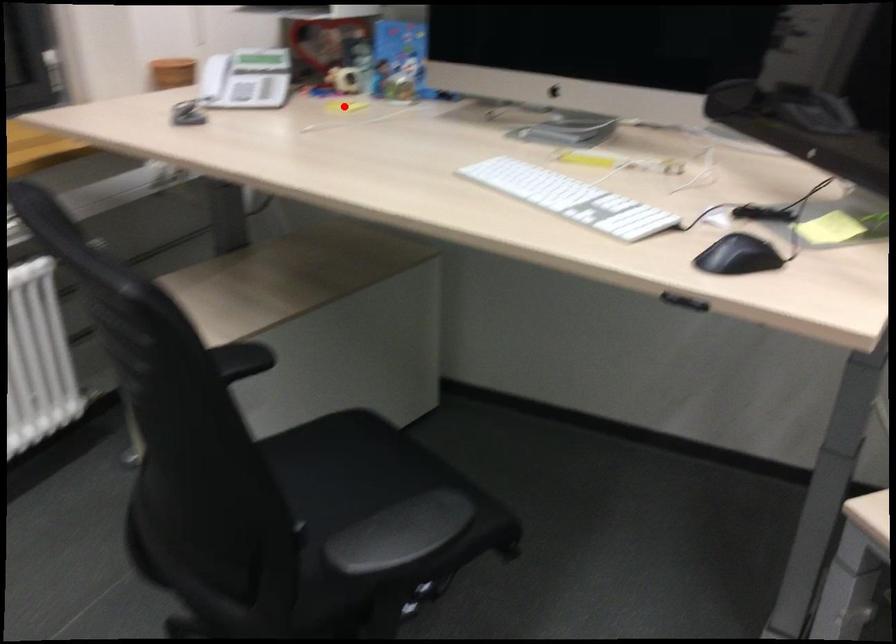
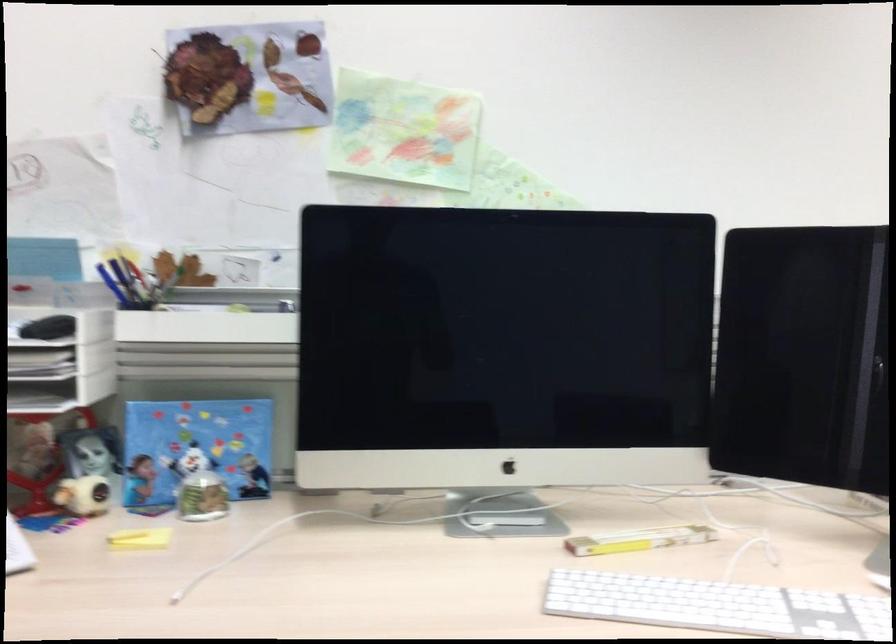
Question: I am providing you with two images of the same scene from different viewpoints. Given a red point in image1, look at the same physical point in image2. Is it:

Choices:
 (A) Closer to the viewpoint
 (B) Farther from the viewpoint

Answer: (A)